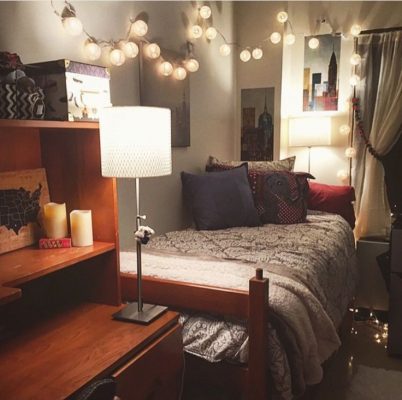
This screenshot has width=402, height=400. I want to click on baseboard, so click(x=129, y=297).